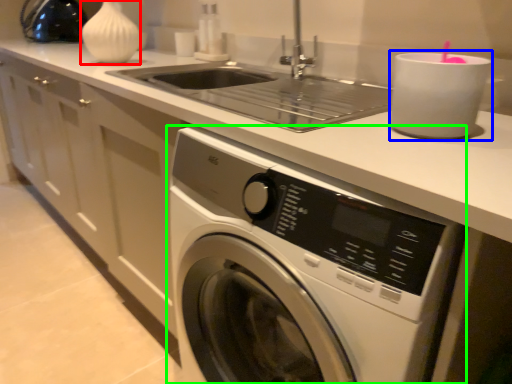
Question: Which object is positioned farthest from vase (highlighted by a red box)? Select from appliance (highlighted by a blue box) and washing machine (highlighted by a green box).

Choices:
 (A) appliance
 (B) washing machine

Answer: (A)